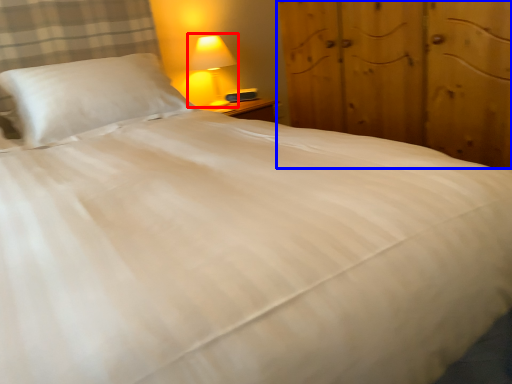
Question: Which object is further to the camera taking this photo, lamp (highlighted by a red box) or dresser (highlighted by a blue box)?

Choices:
 (A) lamp
 (B) dresser

Answer: (A)